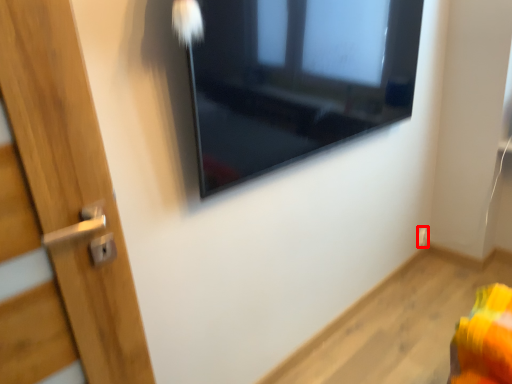
Question: From the image's perspective, where is electric outlet (annotated by the red box) located in relation to window in the image?

Choices:
 (A) below
 (B) above

Answer: (A)